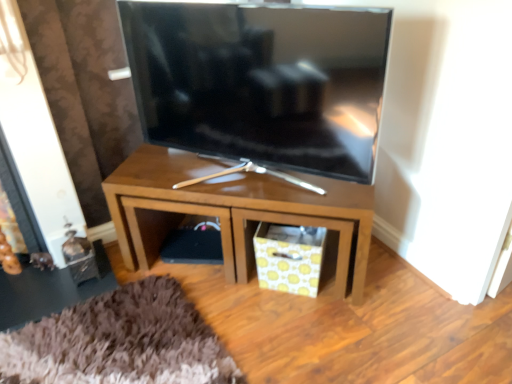
Question: Would you say satin black tv at center is part of wooden tv stand at center's contents?

Choices:
 (A) yes
 (B) no

Answer: (B)

Question: Is wooden tv stand at center taller than satin black tv at center?

Choices:
 (A) no
 (B) yes

Answer: (A)

Question: Is wooden tv stand at center facing away from satin black tv at center?

Choices:
 (A) no
 (B) yes

Answer: (A)

Question: Considering the relative sizes of wooden tv stand at center and satin black tv at center in the image provided, is wooden tv stand at center wider than satin black tv at center?

Choices:
 (A) no
 (B) yes

Answer: (B)

Question: Does wooden tv stand at center have a smaller size compared to satin black tv at center?

Choices:
 (A) no
 (B) yes

Answer: (A)

Question: Does point (289, 248) appear closer or farther from the camera than point (225, 54)?

Choices:
 (A) closer
 (B) farther

Answer: (B)

Question: From a real-world perspective, is yellow patterned paper at lower center positioned above or below satin black tv at center?

Choices:
 (A) below
 (B) above

Answer: (A)

Question: Relative to satin black tv at center, is yellow patterned paper at lower center in front or behind?

Choices:
 (A) behind
 (B) front

Answer: (A)

Question: Considering the positions of yellow patterned paper at lower center and satin black tv at center in the image, is yellow patterned paper at lower center bigger or smaller than satin black tv at center?

Choices:
 (A) small
 (B) big

Answer: (A)

Question: From the image's perspective, is yellow patterned paper at lower center located above or below shiny metallic side table at lower left?

Choices:
 (A) above
 (B) below

Answer: (A)

Question: Is yellow patterned paper at lower center to the left or to the right of shiny metallic side table at lower left in the image?

Choices:
 (A) left
 (B) right

Answer: (B)

Question: Which is correct: yellow patterned paper at lower center is inside shiny metallic side table at lower left, or outside of it?

Choices:
 (A) outside
 (B) inside

Answer: (A)

Question: In terms of width, does yellow patterned paper at lower center look wider or thinner when compared to shiny metallic side table at lower left?

Choices:
 (A) wide
 (B) thin

Answer: (B)

Question: From a real-world perspective, is wooden tv stand at center physically located above or below satin black tv at center?

Choices:
 (A) below
 (B) above

Answer: (A)

Question: Based on their positions, is wooden tv stand at center located to the left or right of satin black tv at center?

Choices:
 (A) left
 (B) right

Answer: (B)